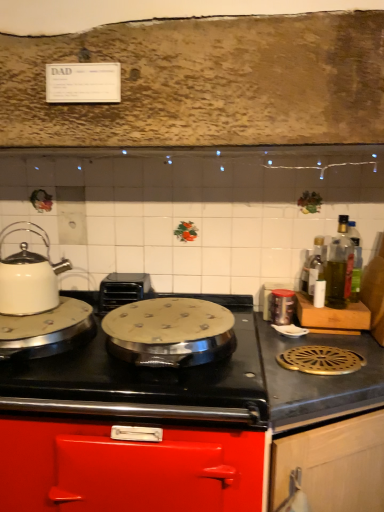
Question: From a real-world perspective, does green glass bottle at right, which is counted as the 2th bottle, starting from the left, sit lower than black plastic toaster at center-left?

Choices:
 (A) no
 (B) yes

Answer: (A)

Question: Considering the relative sizes of green glass bottle at right, the 2th bottle when ordered from right to left, and black plastic toaster at center-left in the image provided, is green glass bottle at right, the 2th bottle when ordered from right to left, thinner than black plastic toaster at center-left?

Choices:
 (A) no
 (B) yes

Answer: (B)

Question: From a real-world perspective, is green glass bottle at right, which is counted as the 2th bottle, starting from the left, positioned over black plastic toaster at center-left based on gravity?

Choices:
 (A) no
 (B) yes

Answer: (B)

Question: Is green glass bottle at right, the 2th bottle when ordered from right to left, at the left side of black plastic toaster at center-left?

Choices:
 (A) yes
 (B) no

Answer: (B)

Question: From the image's perspective, is green glass bottle at right, which is counted as the 2th bottle, starting from the left, on top of black plastic toaster at center-left?

Choices:
 (A) yes
 (B) no

Answer: (A)

Question: Does green glass bottle at right, which is counted as the 2th bottle, starting from the left, have a smaller size compared to black plastic toaster at center-left?

Choices:
 (A) yes
 (B) no

Answer: (A)

Question: Is green glass bottle at right, which is counted as the 2th bottle, starting from the left, taller than metallic gray stovetop at right?

Choices:
 (A) no
 (B) yes

Answer: (A)

Question: From the image's perspective, would you say green glass bottle at right, which is counted as the 2th bottle, starting from the left, is shown under metallic gray stovetop at right?

Choices:
 (A) no
 (B) yes

Answer: (A)

Question: From the image's perspective, is green glass bottle at right, the 2th bottle when ordered from right to left, above metallic gray stovetop at right?

Choices:
 (A) yes
 (B) no

Answer: (A)

Question: Can you confirm if green glass bottle at right, which is counted as the 2th bottle, starting from the left, is smaller than metallic gray stovetop at right?

Choices:
 (A) no
 (B) yes

Answer: (B)

Question: Considering the relative positions of green glass bottle at right, which is counted as the 2th bottle, starting from the left, and metallic gray stovetop at right in the image provided, is green glass bottle at right, which is counted as the 2th bottle, starting from the left, in front of metallic gray stovetop at right?

Choices:
 (A) yes
 (B) no

Answer: (B)

Question: From a real-world perspective, is green glass bottle at right, which is counted as the 2th bottle, starting from the left, beneath metallic gray stovetop at right?

Choices:
 (A) yes
 (B) no

Answer: (B)

Question: Does metallic red cabinet at center, the 1th cabinetry positioned from the left, have a lesser width compared to green glass bottle at right, the 3th bottle viewed from the left?

Choices:
 (A) yes
 (B) no

Answer: (B)